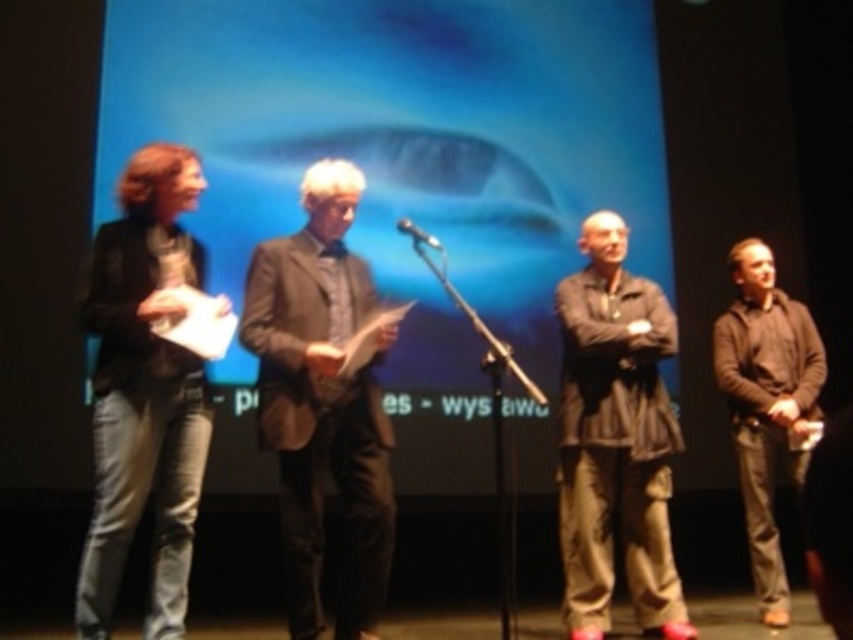
Question: Which point is farther from the camera taking this photo?

Choices:
 (A) (322, 428)
 (B) (103, 272)

Answer: (A)

Question: Among these points, which one is farthest from the camera?

Choices:
 (A) coord(601,496)
 (B) coord(245,323)
 (C) coord(440,246)
 (D) coord(775,275)

Answer: (D)

Question: Is dark gray fabric shirt at center to the right of metallic silver microphone at center from the viewer's perspective?

Choices:
 (A) no
 (B) yes

Answer: (B)

Question: From the image, what is the correct spatial relationship of dark gray jeans at left in relation to brown cotton shirt at right?

Choices:
 (A) right
 (B) left

Answer: (B)

Question: Which point is closer to the camera?

Choices:
 (A) (308, 636)
 (B) (126, 525)
 (C) (751, 248)
 (D) (641, 289)

Answer: (B)

Question: In this image, where is brown cotton shirt at right located relative to metallic silver microphone at center?

Choices:
 (A) above
 (B) below

Answer: (B)